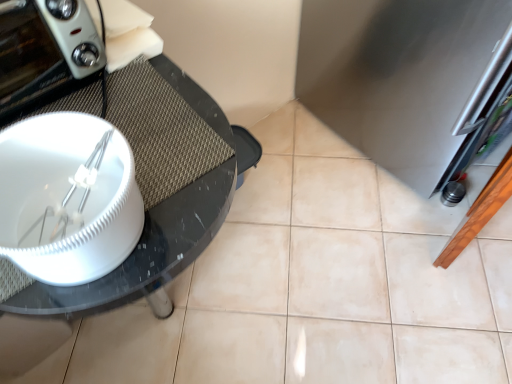
Where is `free location in front of stainless steel refrigerator at right`? Image resolution: width=512 pixels, height=384 pixels. free location in front of stainless steel refrigerator at right is located at coordinates (392, 243).